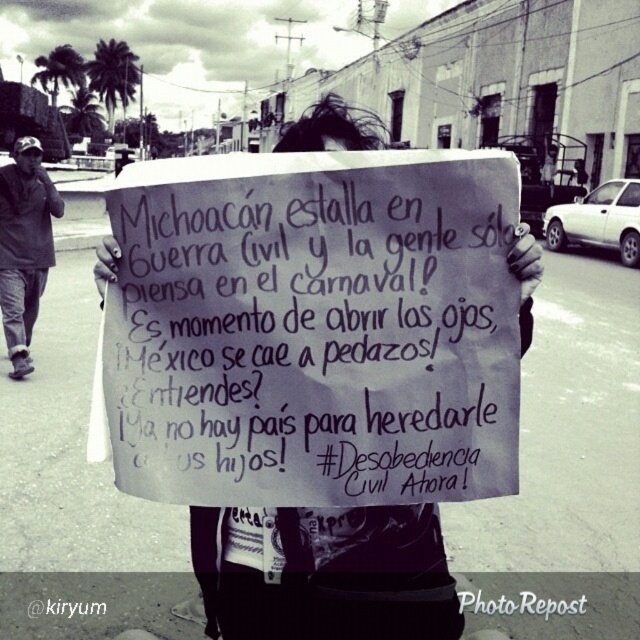
You are a photographer trying to capture the handwritten paper sign at center and the dark gray jacket at left in a single frame. Given that the sign is smaller than the jacket, which object should you focus on first to ensure both are clearly visible in your photo?

Since the handwritten paper sign at center is smaller than the dark gray jacket at left, you should focus on the handwritten paper sign at center first to ensure its details are sharp while keeping the dark gray jacket at left in the frame.

You are a photographer trying to capture the handwritten paper sign at center and the dark gray jacket at left in the same frame. Which object should you focus on first to ensure both are in focus?

The handwritten paper sign at center is closer to the viewer than the dark gray jacket at left. To ensure both are in focus, focus on the handwritten paper sign at center first, as it is closer, and the depth of field will likely include the dark gray jacket at left in the background.

You are a delivery person who needs to deliver a package to the person wearing the dark gray jacket at left. The package must be placed exactly at the location of the handwritten paper sign at center. However, you can only throw the package from a distance of 15 feet or less. Can you successfully deliver the package?

The distance between the handwritten paper sign at center and the dark gray jacket at left is 16.70 feet, which is beyond the 15 feet throwing range. Therefore, you cannot successfully deliver the package by throwing it from the dark gray jacket at left to the handwritten paper sign at center.